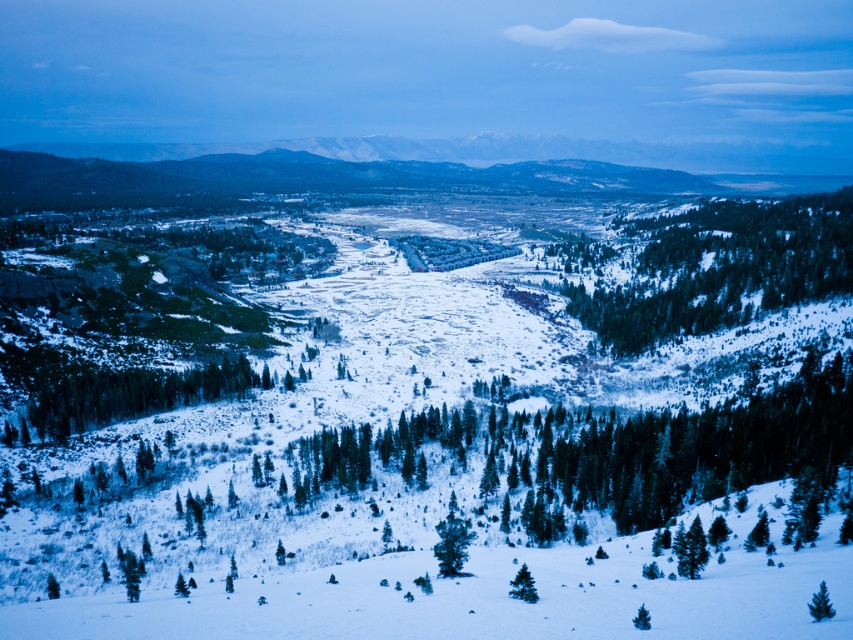
Which of these two, green matte tree at lower center or green matte tree at lower right, stands taller?

green matte tree at lower center

Can you confirm if green matte tree at lower center is taller than green matte tree at lower right?

Indeed, green matte tree at lower center has a greater height compared to green matte tree at lower right.

Between point (517, 572) and point (814, 614), which one is positioned behind?

The point (517, 572) is more distant.

In order to click on green matte tree at lower center in this screenshot , I will do `click(523, 586)`.

Is green textured trees at center-right positioned at the back of green matte tree at lower center?

Yes.

Between point (821, 196) and point (514, 580), which one is positioned behind?

The point (821, 196) is more distant.

Between point (637, 321) and point (529, 579), which one is positioned behind?

The point (637, 321) is behind.

Find the location of a particular element. This screenshot has height=640, width=853. green textured trees at center-right is located at coordinates (x=722, y=268).

Which is above, green matte tree at lower left or green matte tree at lower right?

green matte tree at lower left

Is point (265, 374) closer to camera compared to point (807, 602)?

No, (265, 374) is further to viewer.

The height and width of the screenshot is (640, 853). I want to click on green matte tree at lower left, so click(x=131, y=394).